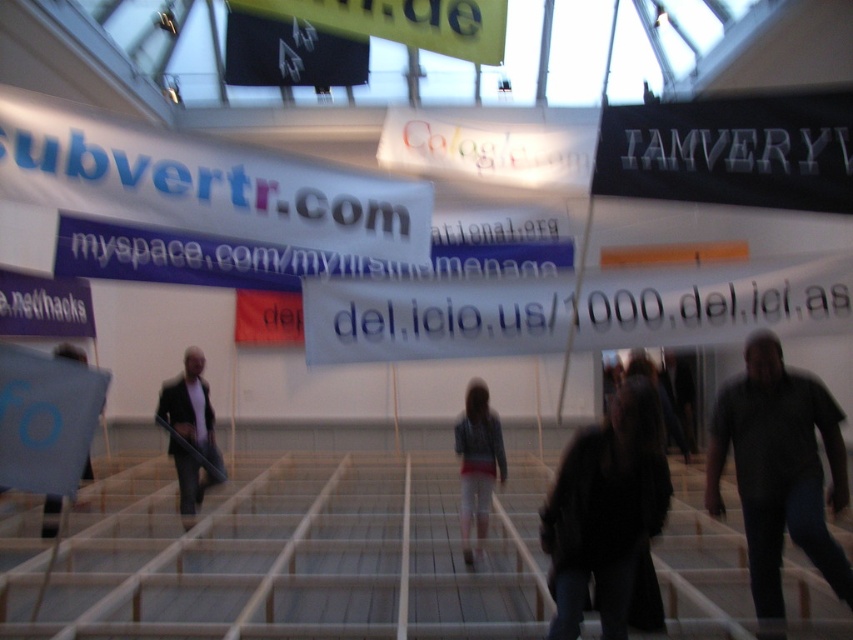
Between point (281, 196) and point (212, 422), which one is positioned behind?

Point (212, 422)

Is white paper banner at upper left taller than dark gray suit at center?

No, white paper banner at upper left is not taller than dark gray suit at center.

What do you see at coordinates (202, 184) in the screenshot?
I see `white paper banner at upper left` at bounding box center [202, 184].

Where is `white paper banner at upper left`? The width and height of the screenshot is (853, 640). white paper banner at upper left is located at coordinates click(202, 184).

Is white paper banner at center to the right of black fuzzy coat at lower right from the viewer's perspective?

Yes, white paper banner at center is to the right of black fuzzy coat at lower right.

Does white paper banner at center have a greater height compared to black fuzzy coat at lower right?

No.

Is point (585, 300) behind point (630, 532)?

Yes, point (585, 300) is behind point (630, 532).

The width and height of the screenshot is (853, 640). What are the coordinates of `white paper banner at center` in the screenshot? It's located at (573, 310).

Can you confirm if black matte sign at upper right is thinner than dark gray suit at center?

No.

Does black matte sign at upper right appear over dark gray suit at center?

Yes, black matte sign at upper right is above dark gray suit at center.

Where is `black matte sign at upper right`? The height and width of the screenshot is (640, 853). black matte sign at upper right is located at coordinates (730, 150).

Where is `black matte sign at upper right`? black matte sign at upper right is located at coordinates (730, 150).